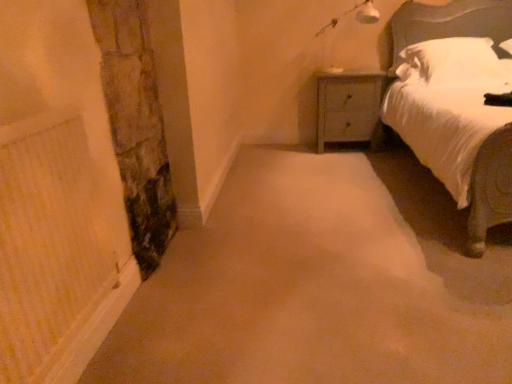
Question: Considering the positions of wooden nightstand at upper right and white plastic lamp at upper right in the image, is wooden nightstand at upper right wider or thinner than white plastic lamp at upper right?

Choices:
 (A) wide
 (B) thin

Answer: (A)

Question: Based on their sizes in the image, would you say wooden nightstand at upper right is bigger or smaller than white plastic lamp at upper right?

Choices:
 (A) small
 (B) big

Answer: (B)

Question: Which is farther from the wooden nightstand at upper right?

Choices:
 (A) stone textured pillar at left
 (B) white soft pillow at upper right
 (C) white plastic lamp at upper right
 (D) white satin bed at upper right

Answer: (A)

Question: Which object is the closest to the wooden nightstand at upper right?

Choices:
 (A) white plastic lamp at upper right
 (B) white soft pillow at upper right
 (C) stone textured pillar at left
 (D) white satin bed at upper right

Answer: (A)